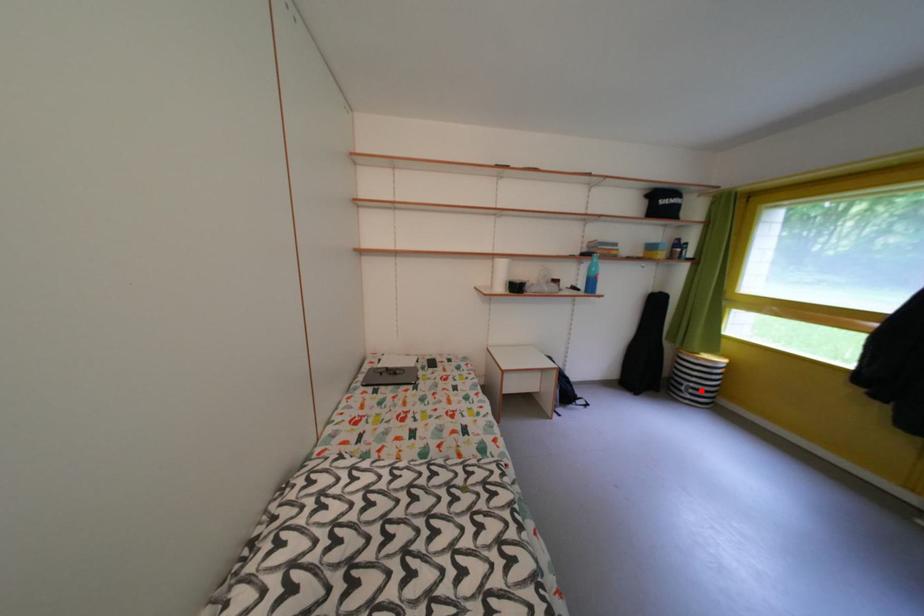
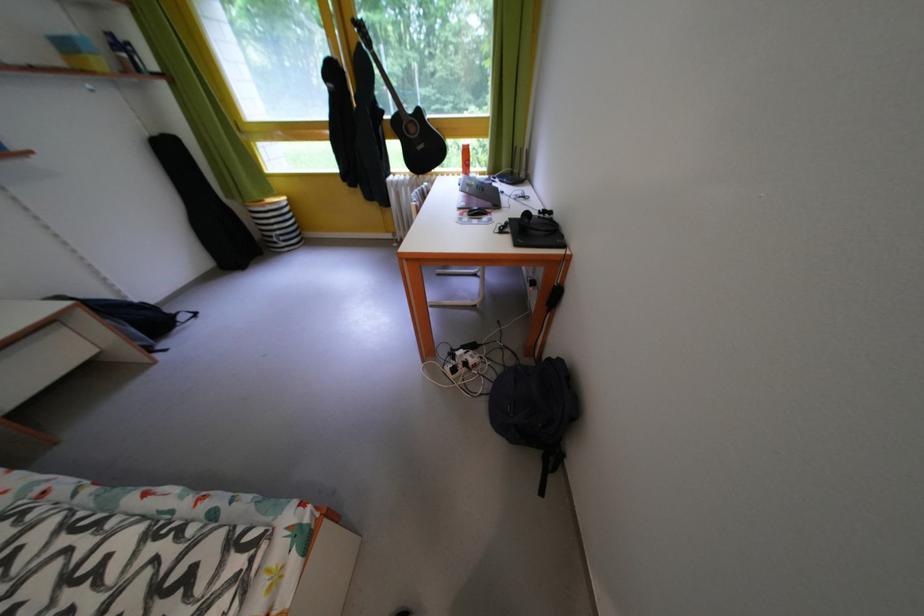
The point at the highlighted location is marked in the first image. Where is the corresponding point in the second image?

(287, 238)